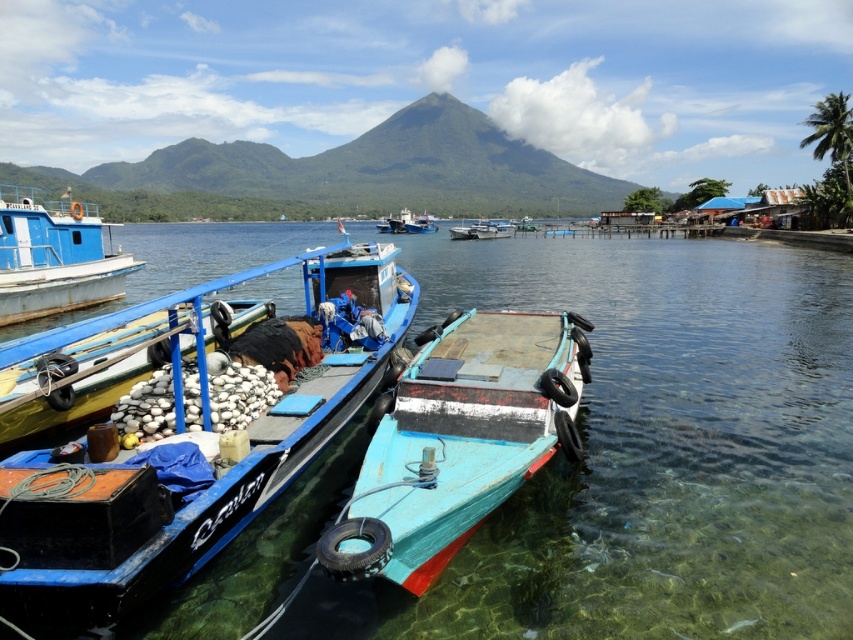
Is blue painted wood boat at center smaller than blue painted wooden boat at left?

Indeed, blue painted wood boat at center has a smaller size compared to blue painted wooden boat at left.

Locate an element on the screen. The width and height of the screenshot is (853, 640). blue painted wood boat at center is located at coordinates (184, 428).

Is point (282, 428) farther from camera compared to point (97, 211)?

No, (282, 428) is in front of (97, 211).

Where is `blue painted wood boat at center`? blue painted wood boat at center is located at coordinates (184, 428).

Is point (553, 554) positioned after point (418, 227)?

No.

Who is shorter, clear water at center or blue painted wooden boat at center?

clear water at center is shorter.

What do you see at coordinates (651, 451) in the screenshot? This screenshot has height=640, width=853. I see `clear water at center` at bounding box center [651, 451].

This screenshot has height=640, width=853. In order to click on clear water at center in this screenshot , I will do `click(651, 451)`.

Is rusty wooden boat at center behind blue painted wooden boat at left?

No.

Is rusty wooden boat at center bigger than blue painted wooden boat at left?

No.

Locate an element on the screen. rusty wooden boat at center is located at coordinates (459, 440).

I want to click on rusty wooden boat at center, so click(x=459, y=440).